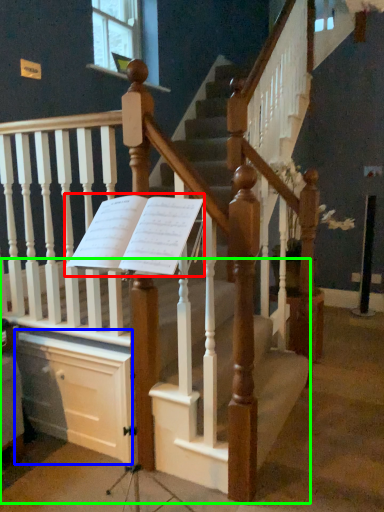
Question: Considering the real-world distances, which object is closest to sheet music (highlighted by a red box)? drawer (highlighted by a blue box) or stairs (highlighted by a green box).

Choices:
 (A) drawer
 (B) stairs

Answer: (B)